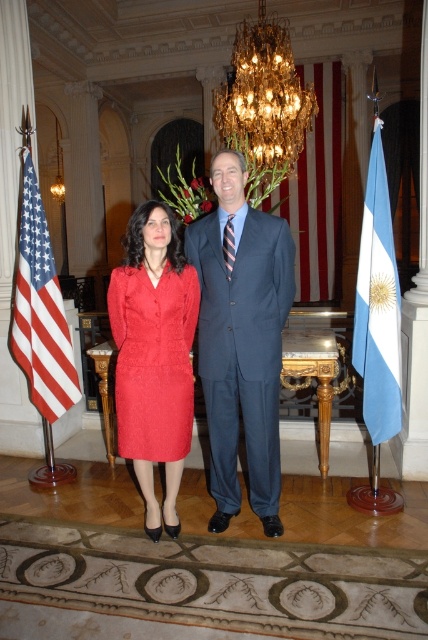
You are a photographer setting up for an event in the described scene. You need to position a camera to capture both the gold crystal chandelier at upper center and the blue fabric flag at right in the same frame. Considering their positions and sizes, which object should you focus on first to ensure both are in the frame?

The gold crystal chandelier at upper center might be wider than blue fabric flag at right, so focusing on the gold crystal chandelier at upper center first would help ensure both objects fit within the frame.

In the scene shown: You are planning to install a new lighting system in the room where the gold crystal chandelier at upper center and the blue fabric flag at right are located. Considering their heights, which object should you adjust the height of the new lighting to avoid shadows from one object blocking the other?

The gold crystal chandelier at upper center is much taller than the blue fabric flag at right, so you should adjust the height of the new lighting system to be above the gold crystal chandelier at upper center to avoid shadows from it blocking the flag.